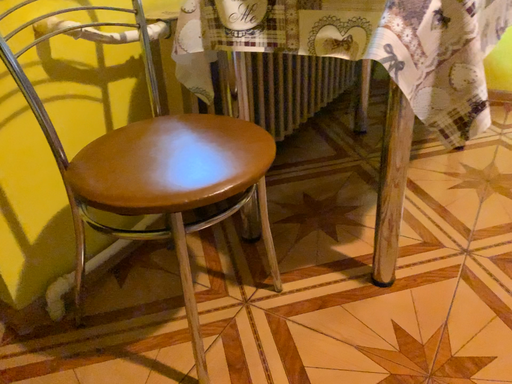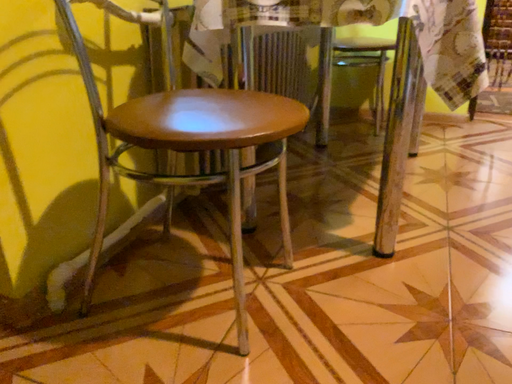
Question: Which way did the camera rotate in the video?

Choices:
 (A) rotated upward
 (B) rotated downward

Answer: (A)